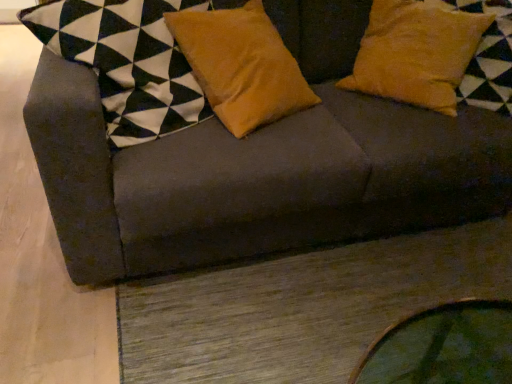
Question: Visually, is suede yellow pillow at upper right, the first pillow viewed from the right, positioned to the left or to the right of velvet orange pillow at center, which is the 2th pillow in right-to-left order?

Choices:
 (A) left
 (B) right

Answer: (B)

Question: Is suede yellow pillow at upper right, which is the 2th pillow in left-to-right order, wider or thinner than velvet orange pillow at center, which appears as the first pillow when viewed from the left?

Choices:
 (A) wide
 (B) thin

Answer: (A)

Question: Estimate the real-world distances between objects in this image. Which object is farther from the suede yellow pillow at upper right, which is the 2th pillow in left-to-right order?

Choices:
 (A) velvet orange pillow at center, which is the 2th pillow in right-to-left order
 (B) dark gray fabric couch at upper center

Answer: (A)

Question: Estimate the real-world distances between objects in this image. Which object is closer to the suede yellow pillow at upper right, the first pillow viewed from the right?

Choices:
 (A) velvet orange pillow at center, which is the 2th pillow in right-to-left order
 (B) dark gray fabric couch at upper center

Answer: (B)